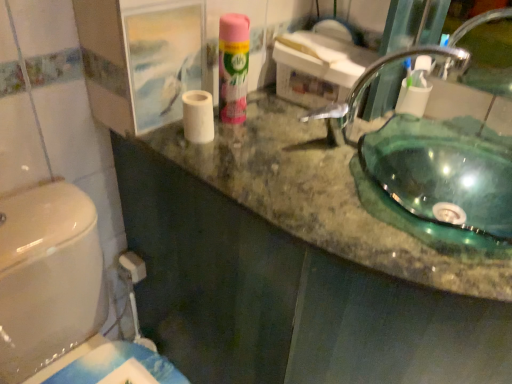
Question: Should I look upward or downward to see transparent glass sink at upper right?

Choices:
 (A) up
 (B) down

Answer: (A)

Question: Is white matte toilet paper at upper right, which is the 1th toilet paper from right to left, shorter than pink matte air freshener at upper center?

Choices:
 (A) no
 (B) yes

Answer: (B)

Question: From a real-world perspective, is white matte toilet paper at upper right, the first toilet paper when ordered from back to front, beneath pink matte air freshener at upper center?

Choices:
 (A) yes
 (B) no

Answer: (A)

Question: Can you confirm if white matte toilet paper at upper right, which is the 1th toilet paper from right to left, is thinner than pink matte air freshener at upper center?

Choices:
 (A) yes
 (B) no

Answer: (A)

Question: Is white matte toilet paper at upper right, positioned as the second toilet paper in left-to-right order, facing away from pink matte air freshener at upper center?

Choices:
 (A) yes
 (B) no

Answer: (B)

Question: Can you confirm if white matte toilet paper at upper right, which is the 1th toilet paper from right to left, is taller than pink matte air freshener at upper center?

Choices:
 (A) no
 (B) yes

Answer: (A)

Question: From a real-world perspective, is white matte toilet paper at upper right, positioned as the second toilet paper in left-to-right order, positioned over pink matte air freshener at upper center based on gravity?

Choices:
 (A) no
 (B) yes

Answer: (A)

Question: Is white matte toilet paper at center, which is the 2th toilet paper from right to left, positioned beyond the bounds of white matte toilet paper at upper right, positioned as the second toilet paper in left-to-right order?

Choices:
 (A) no
 (B) yes

Answer: (B)

Question: From a real-world perspective, is white matte toilet paper at center, marked as the second toilet paper in a back-to-front arrangement, below white matte toilet paper at upper right, the first toilet paper when ordered from back to front?

Choices:
 (A) no
 (B) yes

Answer: (A)

Question: From the image's perspective, is white matte toilet paper at center, which is the 2th toilet paper from right to left, above white matte toilet paper at upper right, which is the 1th toilet paper from right to left?

Choices:
 (A) no
 (B) yes

Answer: (A)

Question: Would you say white matte toilet paper at center, marked as the second toilet paper in a back-to-front arrangement, is a long distance from white matte toilet paper at upper right, positioned as the second toilet paper in left-to-right order?

Choices:
 (A) no
 (B) yes

Answer: (A)

Question: Considering the relative sizes of white matte toilet paper at center, marked as the second toilet paper in a back-to-front arrangement, and white matte toilet paper at upper right, positioned as the second toilet paper in left-to-right order, in the image provided, is white matte toilet paper at center, marked as the second toilet paper in a back-to-front arrangement, bigger than white matte toilet paper at upper right, positioned as the second toilet paper in left-to-right order,?

Choices:
 (A) no
 (B) yes

Answer: (B)

Question: Does white matte toilet paper at center, marked as the second toilet paper in a back-to-front arrangement, lie in front of white matte toilet paper at upper right, positioned as the second toilet paper in left-to-right order?

Choices:
 (A) yes
 (B) no

Answer: (A)

Question: Is pink matte air freshener at upper center located outside white matte toilet paper at upper right, the first toilet paper when ordered from back to front?

Choices:
 (A) no
 (B) yes

Answer: (B)